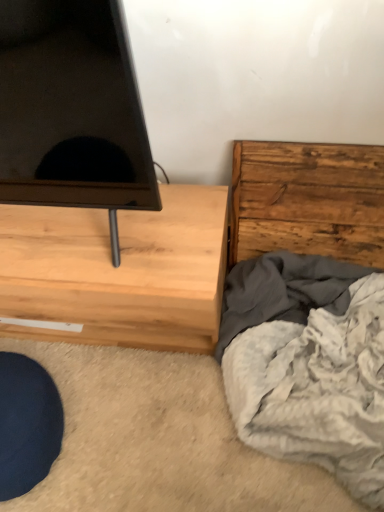
Question: Would you say light wood chest of drawers at left, acting as the 1th chest of drawers starting from the left, is to the left or to the right of rustic wood chest of drawers at right, which is the 2th chest of drawers in left-to-right order, in the picture?

Choices:
 (A) left
 (B) right

Answer: (A)

Question: From the image's perspective, is light wood chest of drawers at left, acting as the 1th chest of drawers starting from the left, located above or below rustic wood chest of drawers at right, which is the 2th chest of drawers in left-to-right order?

Choices:
 (A) above
 (B) below

Answer: (B)

Question: Estimate the real-world distances between objects in this image. Which object is farther from the light wood chest of drawers at left, acting as the 1th chest of drawers starting from the left?

Choices:
 (A) rustic wood chest of drawers at right, which is the 2th chest of drawers in left-to-right order
 (B) soft gray blanket at lower right

Answer: (A)

Question: Which is nearer to the rustic wood chest of drawers at right, which is the 2th chest of drawers in left-to-right order?

Choices:
 (A) soft gray blanket at lower right
 (B) light wood chest of drawers at left, acting as the 1th chest of drawers starting from the left

Answer: (A)